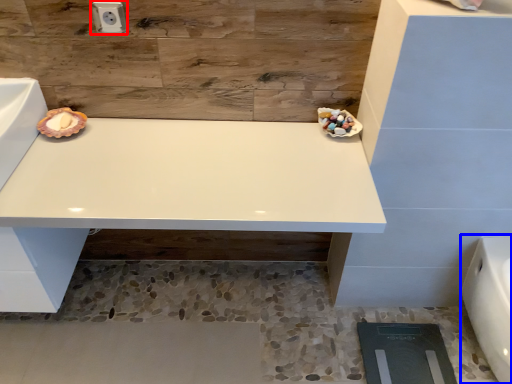
Question: Which point is further to the camera, electric outlet (highlighted by a red box) or porcelain (highlighted by a blue box)?

Choices:
 (A) electric outlet
 (B) porcelain

Answer: (A)